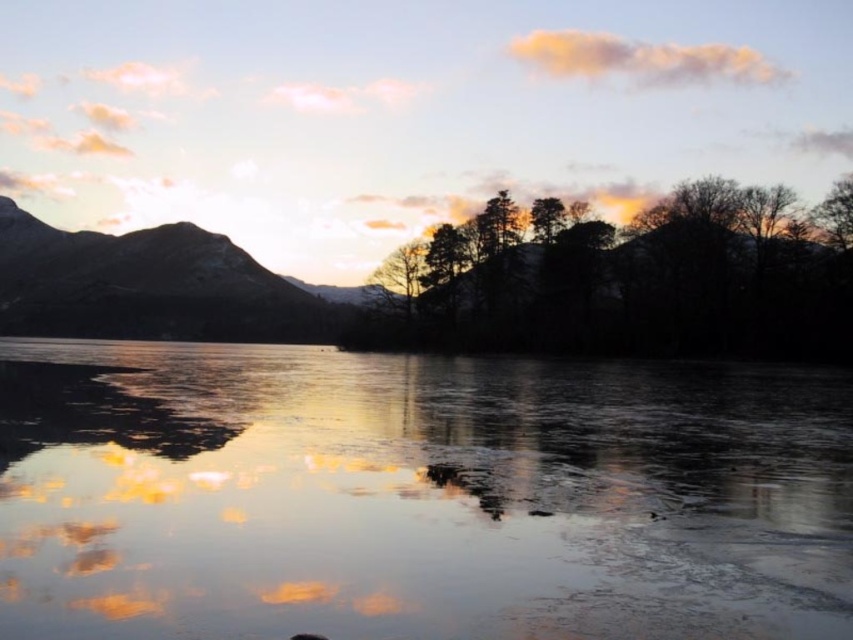
You are an artist trying to paint the scene. You want to ensure the proportions of the translucent ice at center and the silhouette trees at center are accurate. Which object should you paint wider?

The translucent ice at center should be painted wider because its width is larger than the silhouette trees at center.